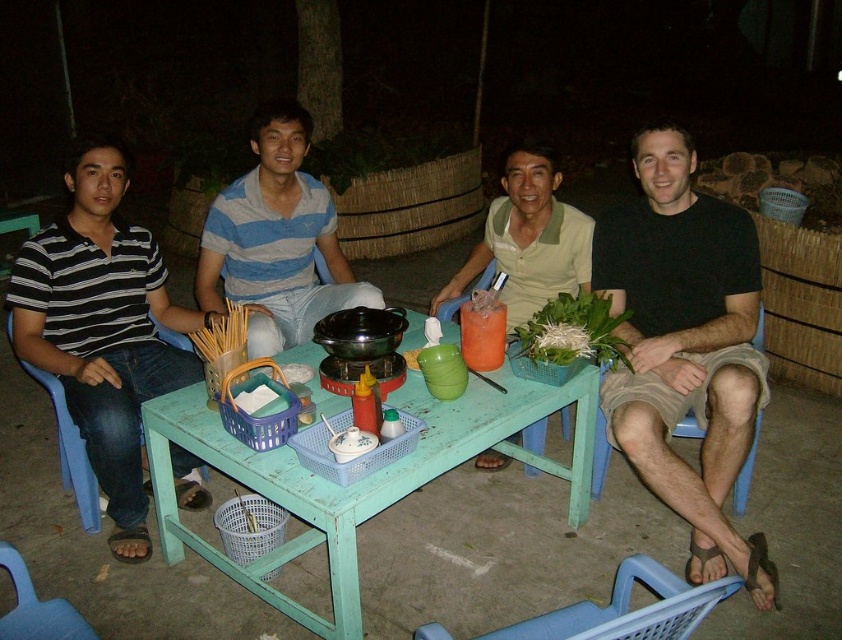
Question: Which object is closer to the camera taking this photo?

Choices:
 (A) green painted wood table at center
 (B) green matte shirt at center
 (C) black cotton shirt at right
 (D) striped cotton shirt at center

Answer: (A)

Question: Is striped cotton shirt at center in front of green leafy vegetables at center?

Choices:
 (A) yes
 (B) no

Answer: (B)

Question: Observing the image, what is the correct spatial positioning of green painted wood table at center in reference to striped cotton shirt at center?

Choices:
 (A) below
 (B) above

Answer: (A)

Question: Is black striped shirt at left thinner than striped cotton shirt at center?

Choices:
 (A) yes
 (B) no

Answer: (A)

Question: Which of the following is the farthest from the observer?

Choices:
 (A) (539, 214)
 (B) (156, 497)
 (C) (536, 355)
 (D) (672, 456)

Answer: (A)

Question: Estimate the real-world distances between objects in this image. Which object is closer to the black striped shirt at left?

Choices:
 (A) green painted wood table at center
 (B) black cotton shirt at right
 (C) green matte shirt at center

Answer: (A)